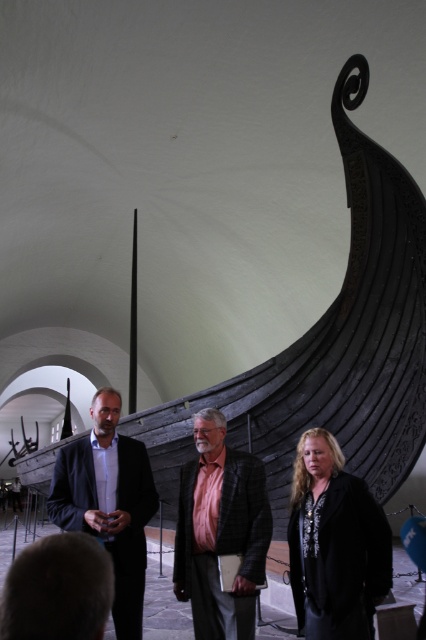
Question: Can you confirm if pink textured shirt at center is positioned to the left of matte black suit at center?

Choices:
 (A) yes
 (B) no

Answer: (B)

Question: Estimate the real-world distances between objects in this image. Which object is farther from the black textured jacket at center?

Choices:
 (A) matte black suit at center
 (B) pink textured shirt at center

Answer: (A)

Question: Estimate the real-world distances between objects in this image. Which object is closer to the matte black suit at center?

Choices:
 (A) black textured jacket at center
 (B) pink textured shirt at center

Answer: (B)

Question: Is pink textured shirt at center smaller than matte black suit at center?

Choices:
 (A) yes
 (B) no

Answer: (A)

Question: Which point appears closest to the camera in this image?

Choices:
 (A) (129, 561)
 (B) (383, 531)

Answer: (B)

Question: In this image, where is black textured jacket at center located relative to matte black suit at center?

Choices:
 (A) above
 (B) below

Answer: (B)